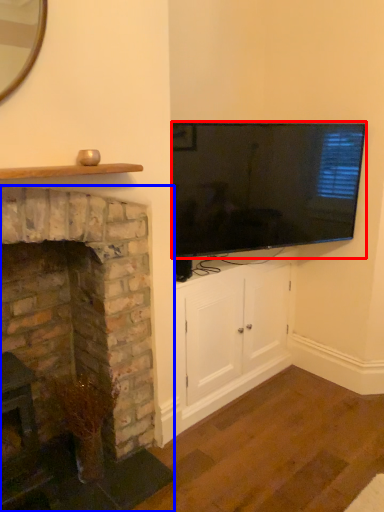
Question: Among these objects, which one is farthest to the camera, television (highlighted by a red box) or fireplace (highlighted by a blue box)?

Choices:
 (A) television
 (B) fireplace

Answer: (A)